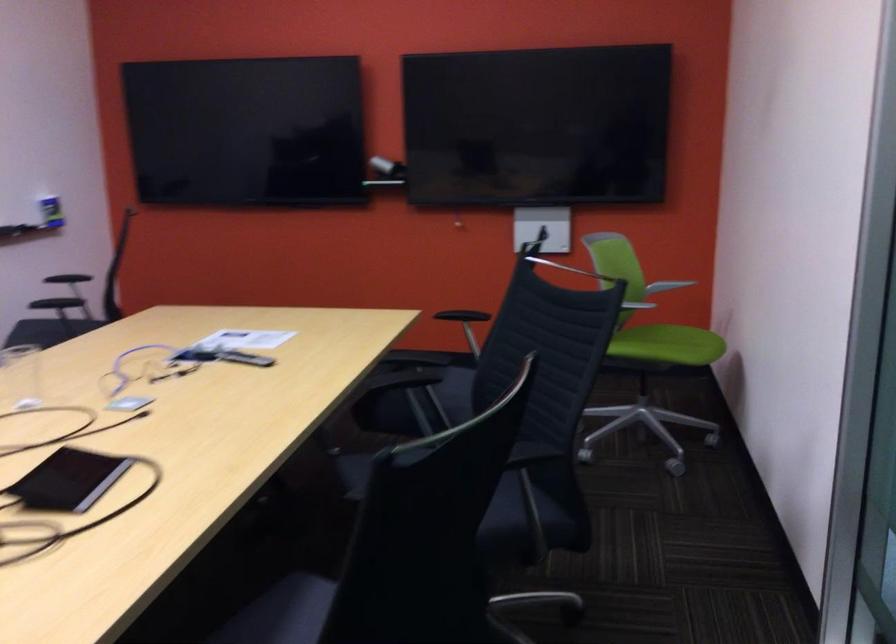
Describe the element at coordinates (462, 315) in the screenshot. I see `a black chair armrest` at that location.